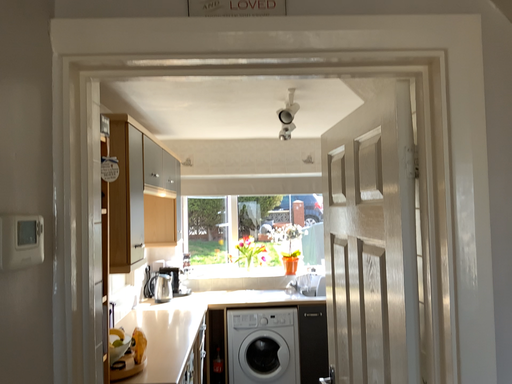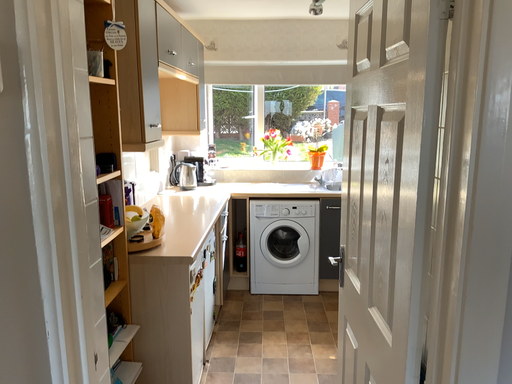
Question: How did the camera likely rotate when shooting the video?

Choices:
 (A) rotated downward
 (B) rotated upward

Answer: (A)